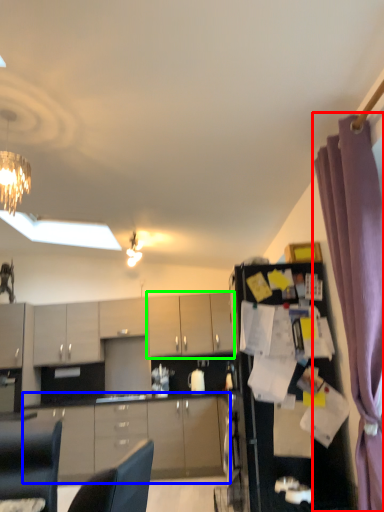
Question: Which object is the farthest from curtain (highlighted by a red box)? Choose among these: cabinetry (highlighted by a blue box) or cabinetry (highlighted by a green box).

Choices:
 (A) cabinetry
 (B) cabinetry

Answer: (B)